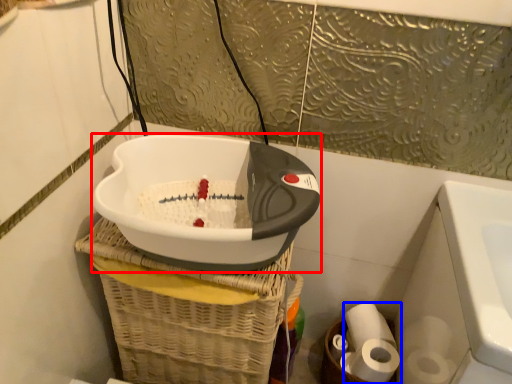
Question: Which of the following is the closest to the observer, appliance (highlighted by a red box) or toilet paper (highlighted by a blue box)?

Choices:
 (A) appliance
 (B) toilet paper

Answer: (A)